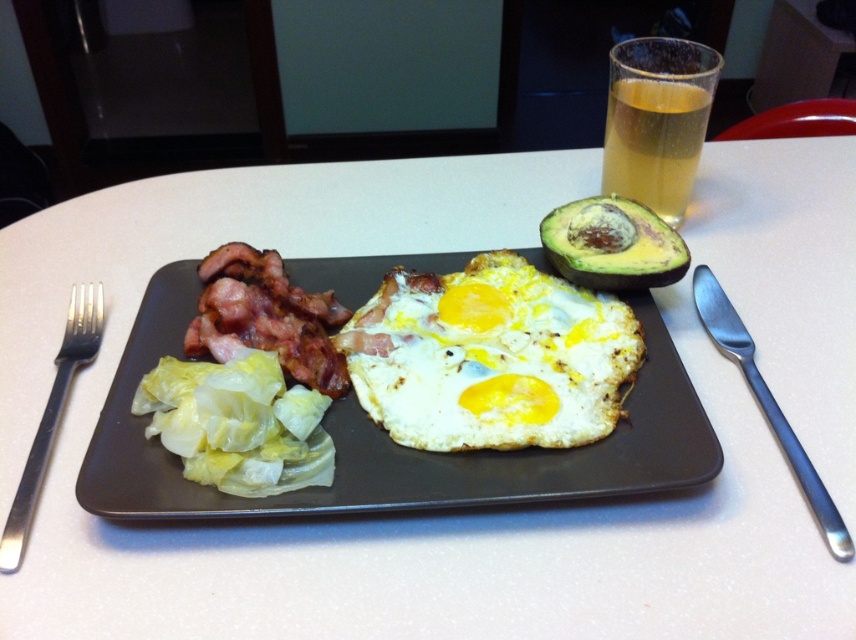
This screenshot has width=856, height=640. What do you see at coordinates (266, 316) in the screenshot? I see `slightly crispy bacon at center-left` at bounding box center [266, 316].

Is slightly crispy bacon at center-left bigger than satin silver knife at right?

Correct, slightly crispy bacon at center-left is larger in size than satin silver knife at right.

Is point (226, 257) positioned in front of point (712, 305)?

Yes, point (226, 257) is closer to viewer.

Locate an element on the screen. Image resolution: width=856 pixels, height=640 pixels. slightly crispy bacon at center-left is located at coordinates (x=266, y=316).

Does satin silver knife at right have a lesser height compared to black metal fork at left?

Result: No, satin silver knife at right is not shorter than black metal fork at left.

Can you confirm if satin silver knife at right is smaller than black metal fork at left?

Yes, satin silver knife at right is smaller than black metal fork at left.

Is point (840, 531) farther from camera compared to point (87, 333)?

No, (840, 531) is closer to viewer.

This screenshot has width=856, height=640. Find the location of `satin silver knife at right`. satin silver knife at right is located at coordinates (767, 404).

Can you confirm if fried yellow egg at center is taller than satin silver knife at right?

In fact, fried yellow egg at center may be shorter than satin silver knife at right.

Is point (369, 410) in front of point (752, 372)?

Yes, it is.

This screenshot has height=640, width=856. What do you see at coordinates (491, 356) in the screenshot? I see `fried yellow egg at center` at bounding box center [491, 356].

You are a GUI agent. You are given a task and a screenshot of the screen. Output one action in this format:
    pyautogui.click(x=<x>, y=<y>)
    Task: Click on the fried yellow egg at center
    
    Given the screenshot: What is the action you would take?
    pyautogui.click(x=491, y=356)